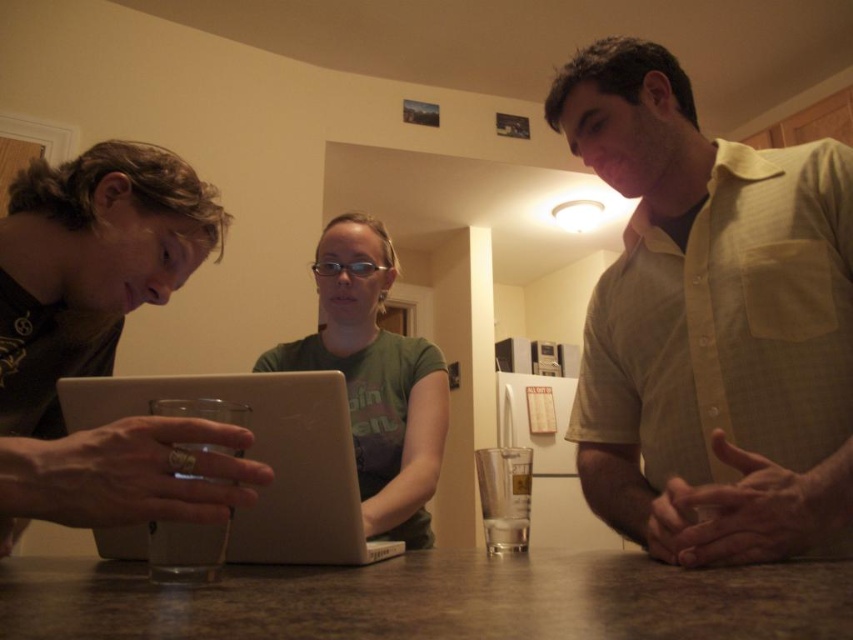
You are trying to decide whether to place a new rectangular box on the table. The box requires a space that is at least as tall as the green matte shirt at center. Can the white matte laptop at center on the table provide enough vertical space for this requirement?

The white matte laptop at center is not as tall as the green matte shirt at center, so it cannot provide enough vertical space for the box that requires a minimum height equal to the green matte shirt at center.

You are a photographer setting up a camera to capture the scene described. The camera is positioned such that it can only focus on objects above a certain horizontal line. If the camera is set to focus on objects above the white matte laptop at center, will it include the green matte shirt at center in the focused area?

The white matte laptop at center is located below the green matte shirt at center, so the green matte shirt at center is above the laptop. Therefore, the camera set to focus above the white matte laptop at center will include the green matte shirt at center in the focused area.